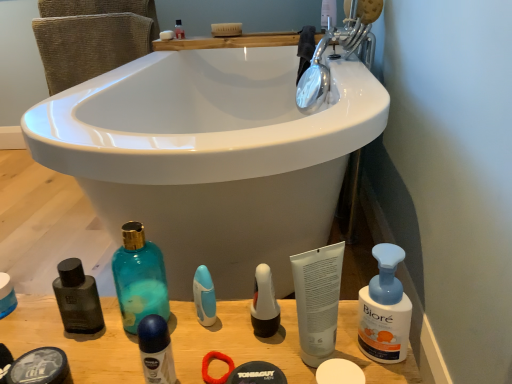
Identify the location of vacant space positioned to the left of white glossy pump bottle at center, the 2th toiletry viewed from the right. (185, 338).